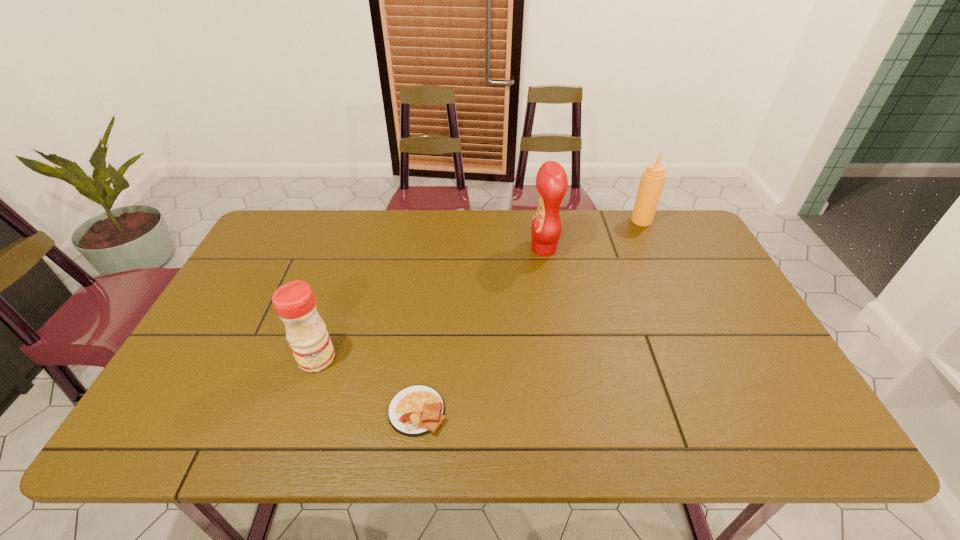
Where is `the second condiment from right to left`? The width and height of the screenshot is (960, 540). the second condiment from right to left is located at coordinates (551, 181).

This screenshot has height=540, width=960. In order to click on the second nearest condiment in this screenshot , I will do `click(551, 181)`.

Identify the location of the farthest object. (653, 178).

The image size is (960, 540). Find the location of `the rightmost condiment`. the rightmost condiment is located at coordinates (653, 178).

The width and height of the screenshot is (960, 540). In order to click on the third farthest object in this screenshot , I will do `click(294, 302)`.

Where is `the nearest condiment`? The height and width of the screenshot is (540, 960). the nearest condiment is located at coordinates (294, 302).

Where is `omelet`? Image resolution: width=960 pixels, height=540 pixels. omelet is located at coordinates (417, 410).

Identify the location of the third object from right to left. (417, 410).

The width and height of the screenshot is (960, 540). What are the coordinates of `free space located 0.210m on the label side of the second condiment from left to right` in the screenshot? It's located at (464, 248).

Identify the location of vacant space situated 0.390m on the label side of the second condiment from left to right. (408, 248).